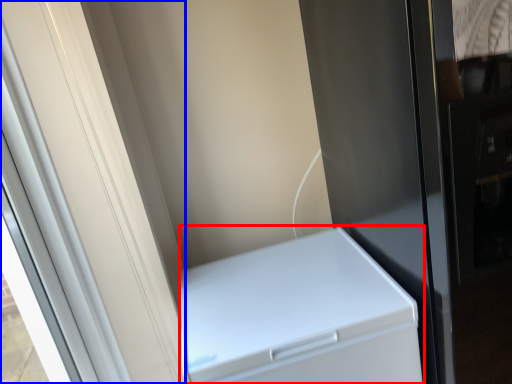
Question: Which object appears farthest to the camera in this image, home appliance (highlighted by a red box) or screen door (highlighted by a blue box)?

Choices:
 (A) home appliance
 (B) screen door

Answer: (A)